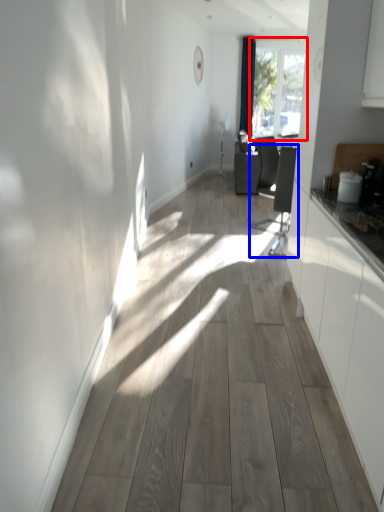
Question: Which object is closer to the camera taking this photo, window (highlighted by a red box) or swivel chair (highlighted by a blue box)?

Choices:
 (A) window
 (B) swivel chair

Answer: (B)